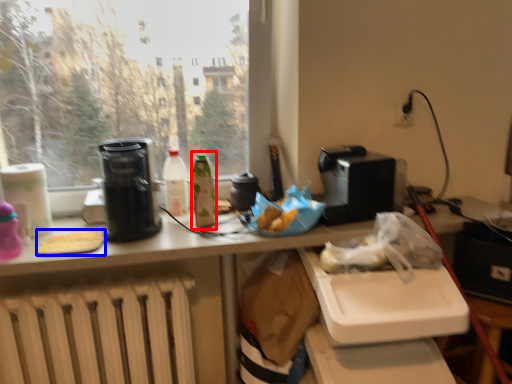
Question: Which point is closer to the camera, bottle (highlighted by a red box) or food (highlighted by a blue box)?

Choices:
 (A) bottle
 (B) food

Answer: (B)